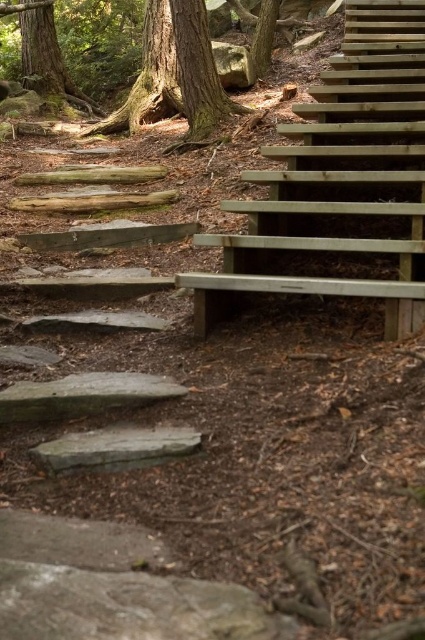
You are standing at the base of the wooden stairs on the right side of the image and want to reach a point marked by point (198, 276) and point (224, 106). Which point is closer to you?

Point (198, 276) is closer to the viewer than point (224, 106), so you will reach point (198, 276) first.

You are standing at the bottom of the wooden stairs at upper right. If you look directly to your left, which direction would the natural stone pathway be located relative to your position?

The natural stone pathway is located to the left of the wooden stairs at upper right.

You are standing at the base of the wooden stairs at upper right and want to walk towards the green rough bark tree at upper left. Which direction should you move to get closer to the tree?

The wooden stairs at upper right are closer to you than the green rough bark tree at upper left. To move towards the tree, you should walk away from the stairs and head towards the upper left direction where the tree is located.